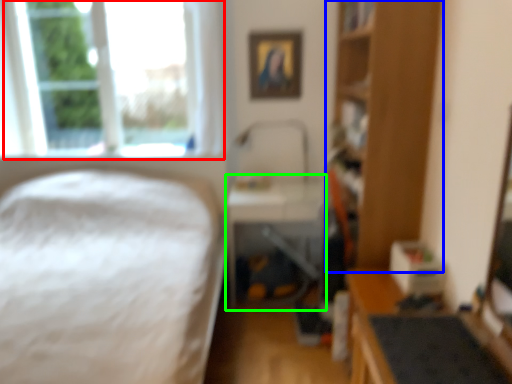
Question: Considering the real-world distances, which object is farthest from window (highlighted by a red box)? bookshelf (highlighted by a blue box) or table (highlighted by a green box)?

Choices:
 (A) bookshelf
 (B) table

Answer: (A)